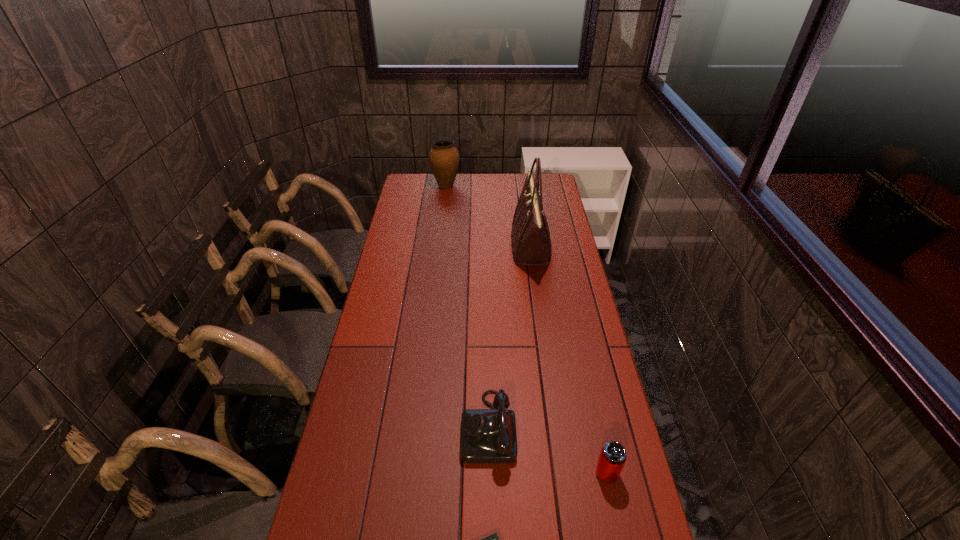
Locate an element on the screen. This screenshot has height=540, width=960. vacant region located on the left of the soda can is located at coordinates (531, 473).

Where is `free space located on the dial of the telephone`? The image size is (960, 540). free space located on the dial of the telephone is located at coordinates (406, 427).

You are a GUI agent. You are given a task and a screenshot of the screen. Output one action in this format:
    pyautogui.click(x=<x>, y=<y>)
    Task: Click on the free location located on the dial of the telephone
    This screenshot has width=960, height=540.
    Given the screenshot: What is the action you would take?
    pyautogui.click(x=348, y=427)

This screenshot has width=960, height=540. In order to click on vacant space located on the dial of the telephone in this screenshot , I will do `click(413, 427)`.

Locate an element on the screen. The height and width of the screenshot is (540, 960). object situated at the far edge is located at coordinates (444, 158).

Locate an element on the screen. object positioned at the left edge is located at coordinates (444, 158).

The width and height of the screenshot is (960, 540). I want to click on handbag present at the right edge, so click(530, 237).

Identify the location of soda can that is at the right edge. Image resolution: width=960 pixels, height=540 pixels. (612, 458).

Image resolution: width=960 pixels, height=540 pixels. I want to click on object situated at the far left corner, so click(444, 158).

In order to click on vacant space at the far edge of the desktop in this screenshot , I will do `click(462, 186)`.